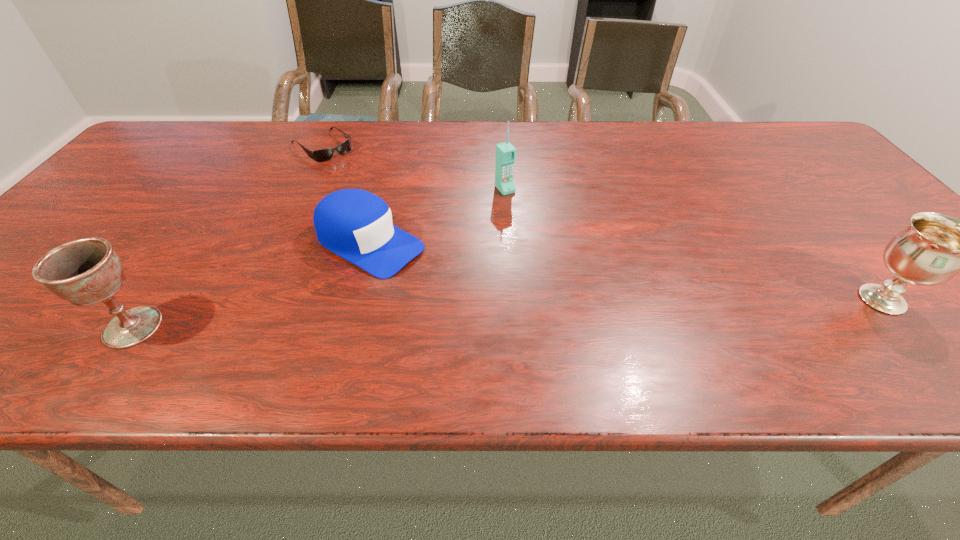
You are a GUI agent. You are given a task and a screenshot of the screen. Output one action in this format:
    pyautogui.click(x=<x>, y=<y>)
    Task: Click on the left chalice
    This screenshot has width=960, height=540.
    Given the screenshot: What is the action you would take?
    pyautogui.click(x=87, y=271)

The width and height of the screenshot is (960, 540). Find the location of `the right chalice`. the right chalice is located at coordinates (934, 248).

Identify the location of cellular telephone. point(505,153).

Identify the location of the fourth nearest object. (505, 153).

In order to click on the farthest object in this screenshot , I will do `click(322, 155)`.

Where is `sunglasses`? This screenshot has height=540, width=960. sunglasses is located at coordinates (322, 155).

The height and width of the screenshot is (540, 960). Identify the location of baseball cap. (355, 224).

At what (x,y) coordinates should I click in order to perform the action: click on the fourth tallest object. Please return your answer as a coordinate pair (x, y). Looking at the image, I should click on (355, 224).

Where is `free space located 0.160m on the back of the left chalice`? free space located 0.160m on the back of the left chalice is located at coordinates (185, 251).

Where is `vacant position located on the left of the rightmost object`? The width and height of the screenshot is (960, 540). vacant position located on the left of the rightmost object is located at coordinates (772, 300).